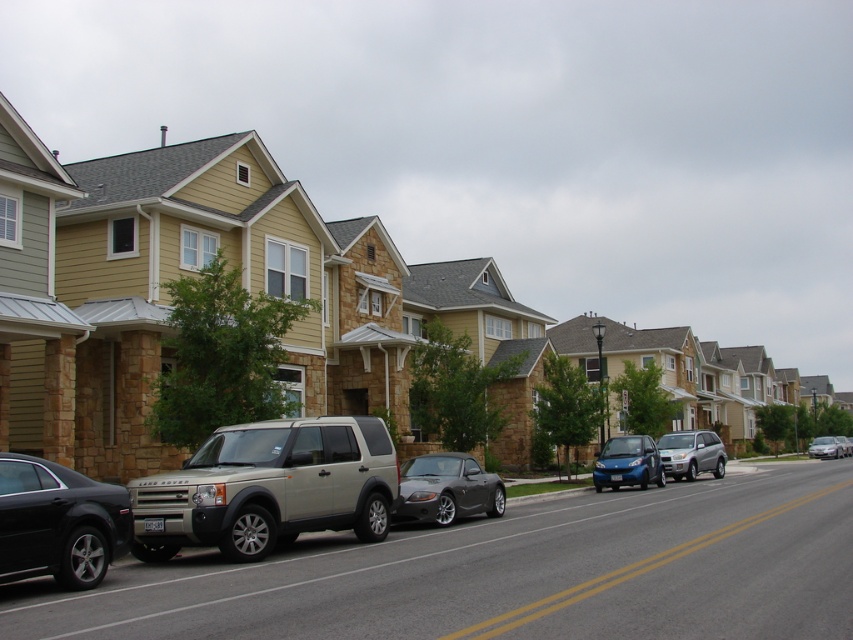
Question: Which object is positioned closest to the metallic silver sedan at center-right?

Choices:
 (A) shiny black sedan at left
 (B) smooth asphalt road at center
 (C) satin silver suv at center-right

Answer: (C)

Question: Can you confirm if shiny black sedan at left is positioned below smooth asphalt road at center?

Choices:
 (A) no
 (B) yes

Answer: (A)

Question: Among these objects, which one is nearest to the camera?

Choices:
 (A) shiny blue car at center
 (B) satin silver convertible at center
 (C) satin gold suv at center
 (D) satin silver suv at center-right

Answer: (C)

Question: Can you confirm if smooth asphalt road at center is positioned above satin silver convertible at center?

Choices:
 (A) yes
 (B) no

Answer: (B)

Question: Observing the image, what is the correct spatial positioning of satin silver convertible at center in reference to metallic silver sedan at center-right?

Choices:
 (A) below
 (B) above

Answer: (B)

Question: Which is farther from the satin gold suv at center?

Choices:
 (A) metallic silver sedan at center
 (B) satin silver convertible at center
 (C) shiny black sedan at left
 (D) shiny blue car at center

Answer: (A)